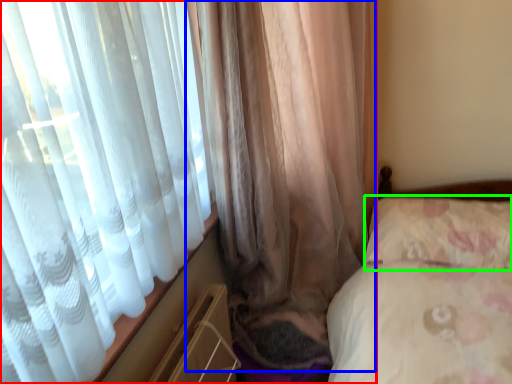
Question: Which is nearer to the curtain (highlighted by a red box)? curtain (highlighted by a blue box) or pillow (highlighted by a green box).

Choices:
 (A) curtain
 (B) pillow

Answer: (A)